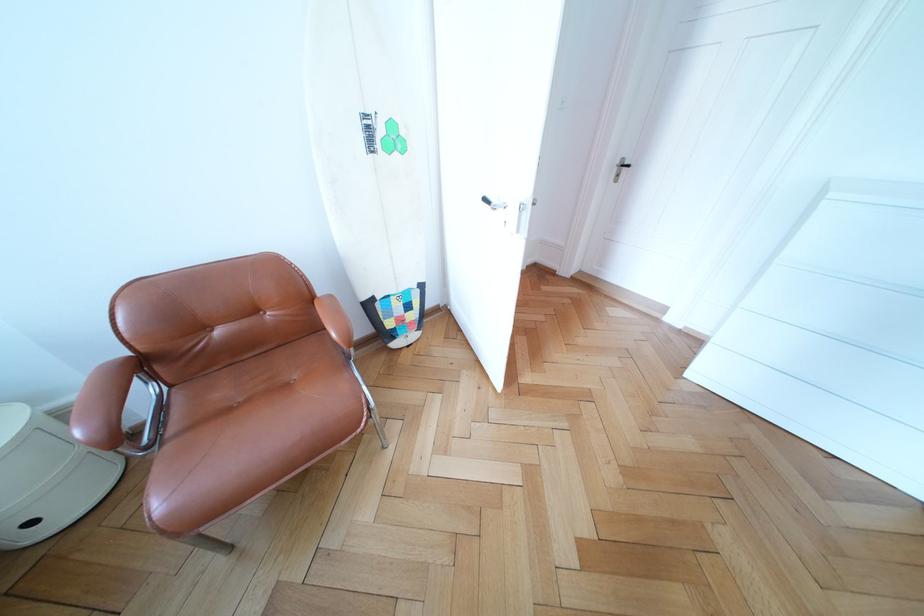
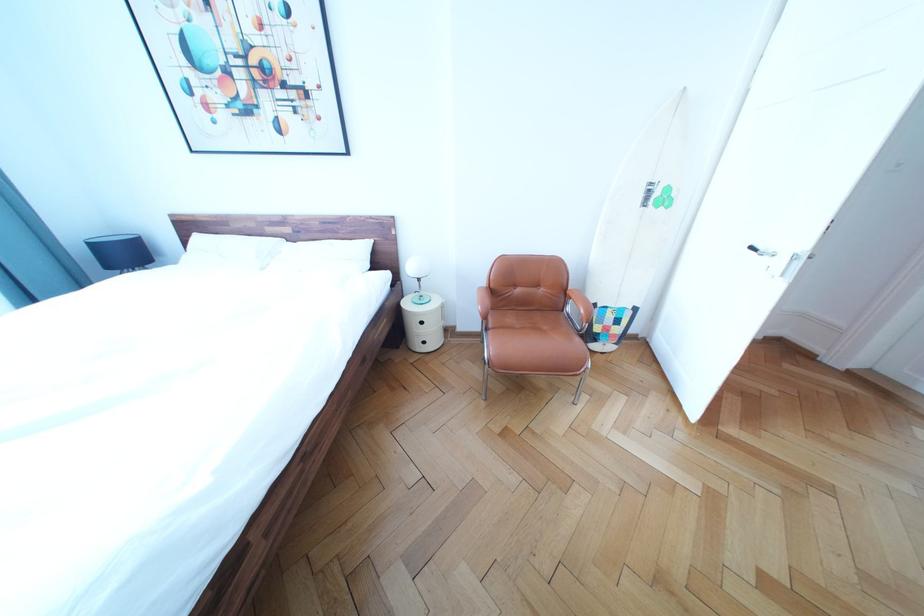
Question: The first image is from the beginning of the video and the second image is from the end. How did the camera likely rotate when shooting the video?

Choices:
 (A) Left
 (B) Right
 (C) Up
 (D) Down

Answer: (A)